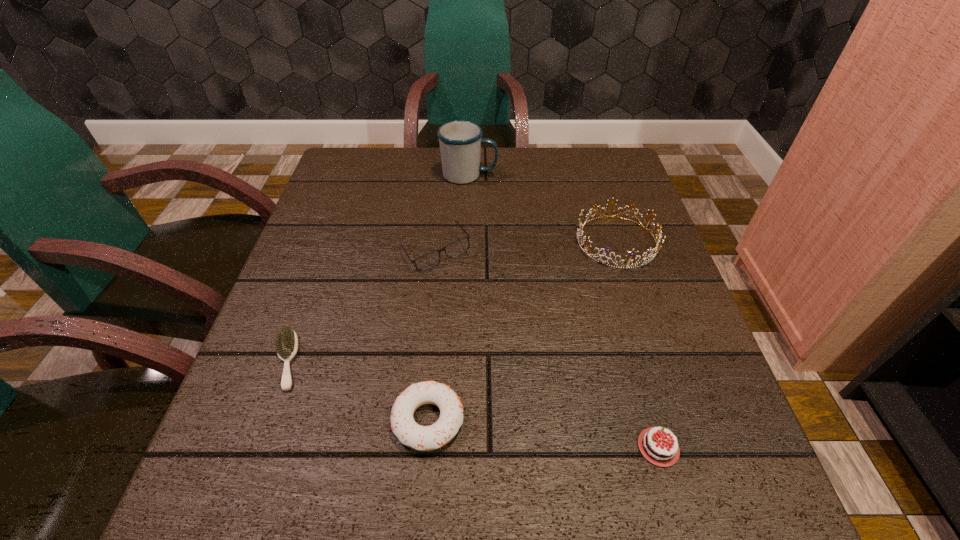
At what (x,y) coordinates should I click in order to perform the action: click on vacant space that is in between the doughnut and the chocolate cake. Please return your answer as a coordinate pair (x, y). The width and height of the screenshot is (960, 540). Looking at the image, I should click on (543, 434).

Where is `free spot between the doughnut and the leftmost object`? Image resolution: width=960 pixels, height=540 pixels. free spot between the doughnut and the leftmost object is located at coordinates (357, 390).

The image size is (960, 540). Identify the location of vacant space that's between the fifth shortest object and the fourth shortest object. (526, 246).

Where is `free space between the doughnut and the scrubbing brush`? free space between the doughnut and the scrubbing brush is located at coordinates (357, 390).

What are the coordinates of `vacant space that's between the scrubbing brush and the tiara` in the screenshot? It's located at (452, 301).

Locate an element on the screen. The height and width of the screenshot is (540, 960). vacant space that's between the spectacles and the scrubbing brush is located at coordinates (361, 306).

I want to click on blank region between the doughnut and the third tallest object, so click(432, 335).

Identify which object is the second nearest to the doughnut. Please provide its 2D coordinates. Your answer should be formatted as a tuple, i.e. [(x, y)], where the tuple contains the x and y coordinates of a point satisfying the conditions above.

[(660, 452)]

Where is `the second closest object to the chocolate cake`? Image resolution: width=960 pixels, height=540 pixels. the second closest object to the chocolate cake is located at coordinates (651, 256).

Identify the location of vacant region that satisfies the following two spatial constraints: 1. on the handle side of the tallest object; 2. on the left side of the second shortest object. (461, 447).